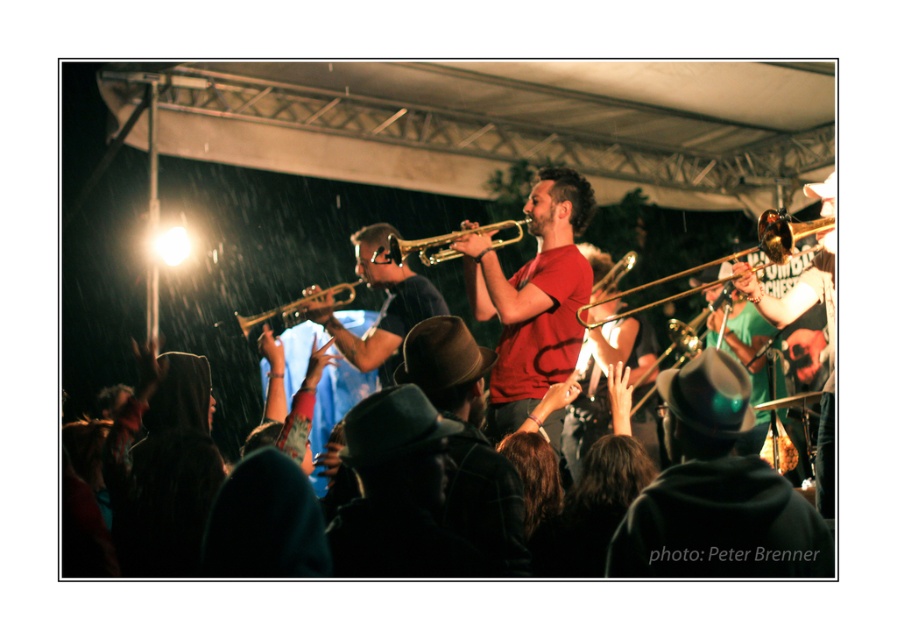
Question: Can you confirm if matte red shirt at center is bigger than shiny brass trombone at center?

Choices:
 (A) yes
 (B) no

Answer: (B)

Question: Does gold shiny trumpet at center appear on the left side of gold brass trumpet at center?

Choices:
 (A) no
 (B) yes

Answer: (B)

Question: Which point appears farthest from the camera in this image?

Choices:
 (A) [x=344, y=300]
 (B) [x=575, y=314]

Answer: (A)

Question: Which point is farther from the camera taking this photo?

Choices:
 (A) coord(617,268)
 (B) coord(645,500)
 (C) coord(251,324)

Answer: (A)

Question: Is matte red shirt at center to the right of shiny brass trombone at center from the viewer's perspective?

Choices:
 (A) no
 (B) yes

Answer: (A)

Question: Which point appears farthest from the camera in this image?

Choices:
 (A) (273, 310)
 (B) (695, 524)
 (C) (524, 300)

Answer: (A)